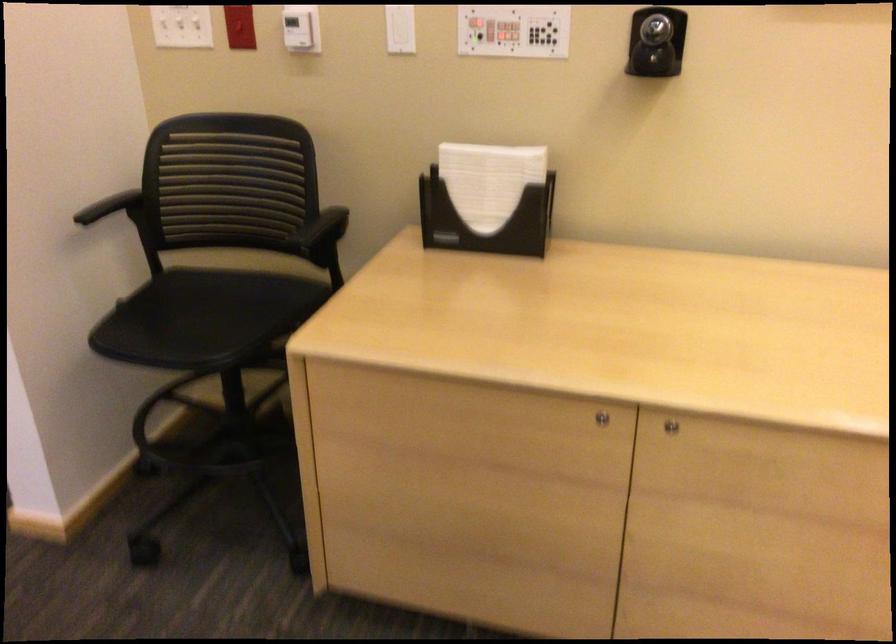
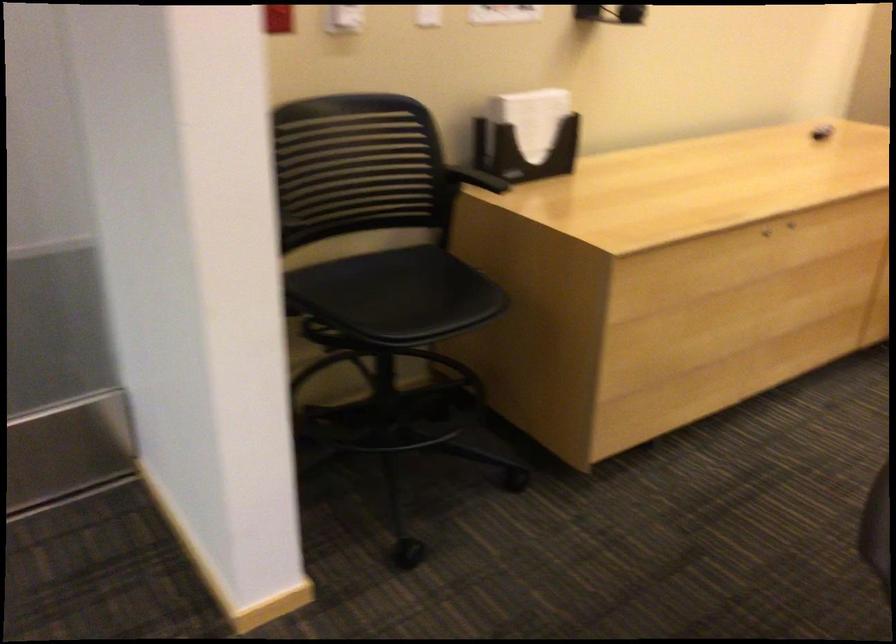
Find the pixel in the second image that matches (633,401) in the first image.

(765, 232)